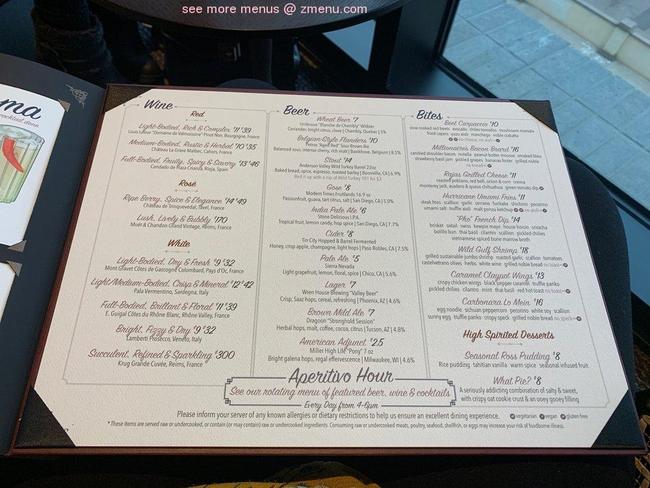
This screenshot has width=650, height=488. In order to click on black table in this screenshot , I will do `click(290, 26)`.